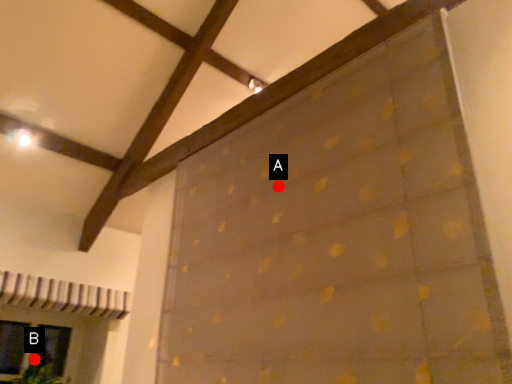
Question: Two points are circled on the image, labeled by A and B beside each circle. Which point is closer to the camera?

Choices:
 (A) A is closer
 (B) B is closer

Answer: (A)